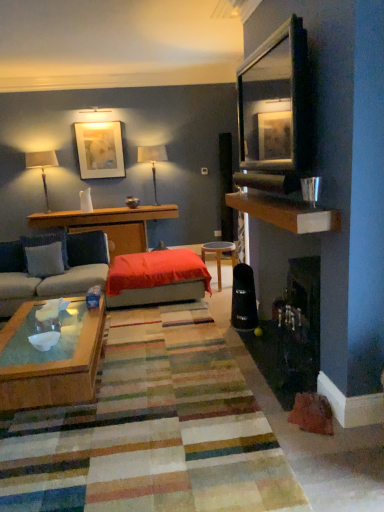
Question: Is light blue fabric pillow at left, which is counted as the 2th pillow, starting from the back, wider than velvet red ottoman at center?

Choices:
 (A) no
 (B) yes

Answer: (A)

Question: Does light blue fabric pillow at left, which is counted as the 2th pillow, starting from the back, appear on the right side of velvet red ottoman at center?

Choices:
 (A) no
 (B) yes

Answer: (A)

Question: Is light blue fabric pillow at left, which is counted as the 2th pillow, starting from the back, facing away from velvet red ottoman at center?

Choices:
 (A) yes
 (B) no

Answer: (B)

Question: From a real-world perspective, is light blue fabric pillow at left, marked as the 1th pillow in a front-to-back arrangement, located beneath velvet red ottoman at center?

Choices:
 (A) no
 (B) yes

Answer: (A)

Question: Is point (26, 157) closer or farther from the camera than point (147, 157)?

Choices:
 (A) closer
 (B) farther

Answer: (A)

Question: In terms of size, does matte white lampshade at upper left, placed as the 1th lamp when sorted from left to right, appear bigger or smaller than matte black lampshade at upper center, the 2th lamp from the left?

Choices:
 (A) small
 (B) big

Answer: (B)

Question: In the image, is matte white lampshade at upper left, placed as the 2th lamp when sorted from right to left, on the left side or the right side of matte black lampshade at upper center, the 2th lamp from the left?

Choices:
 (A) left
 (B) right

Answer: (A)

Question: In terms of width, does matte white lampshade at upper left, placed as the 1th lamp when sorted from left to right, look wider or thinner when compared to matte black lampshade at upper center, the 2th lamp from the left?

Choices:
 (A) wide
 (B) thin

Answer: (B)

Question: Considering the relative positions of matte black lampshade at upper center, the 2th lamp from the left, and matte white picture frame at upper center in the image provided, is matte black lampshade at upper center, the 2th lamp from the left, to the left or to the right of matte white picture frame at upper center?

Choices:
 (A) right
 (B) left

Answer: (A)

Question: Considering the positions of matte black lampshade at upper center, the 1th lamp viewed from the right, and matte white picture frame at upper center in the image, is matte black lampshade at upper center, the 1th lamp viewed from the right, bigger or smaller than matte white picture frame at upper center?

Choices:
 (A) big
 (B) small

Answer: (A)

Question: Choose the correct answer: Is matte black lampshade at upper center, the 1th lamp viewed from the right, inside matte white picture frame at upper center or outside it?

Choices:
 (A) inside
 (B) outside

Answer: (B)

Question: Is matte black lampshade at upper center, the 2th lamp from the left, wider or thinner than matte white picture frame at upper center?

Choices:
 (A) wide
 (B) thin

Answer: (A)

Question: Is wooden shelf at upper right inside the boundaries of woodendesk at left, or outside?

Choices:
 (A) inside
 (B) outside

Answer: (B)

Question: Is wooden shelf at upper right to the left or to the right of woodendesk at left in the image?

Choices:
 (A) left
 (B) right

Answer: (B)